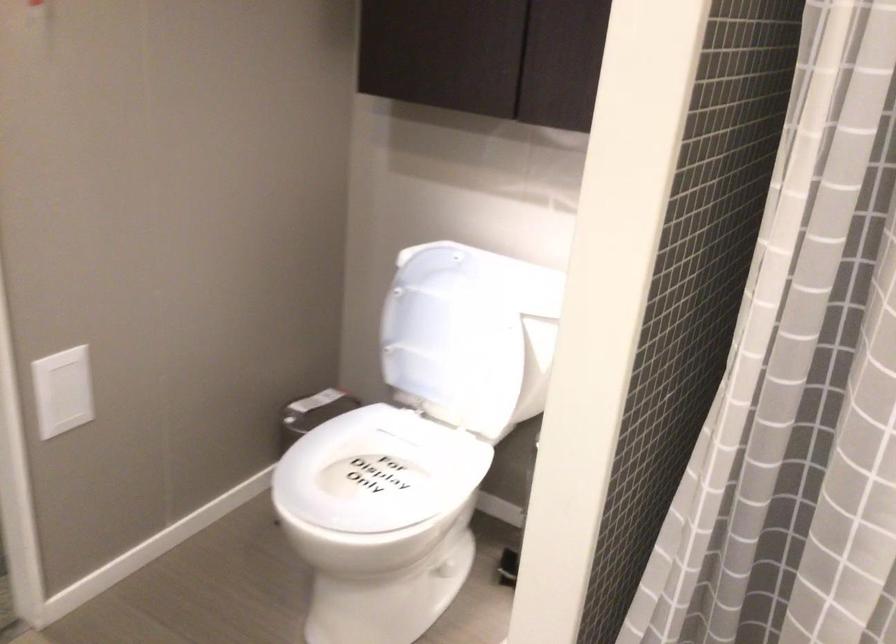
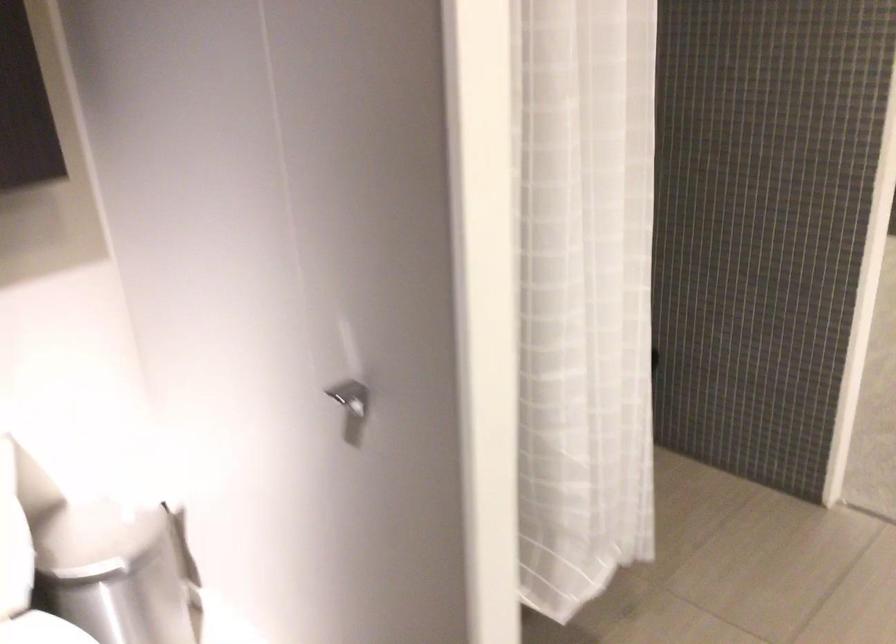
Based on the continuous images, in which direction is the camera rotating?

The camera's rotation is toward right-down.